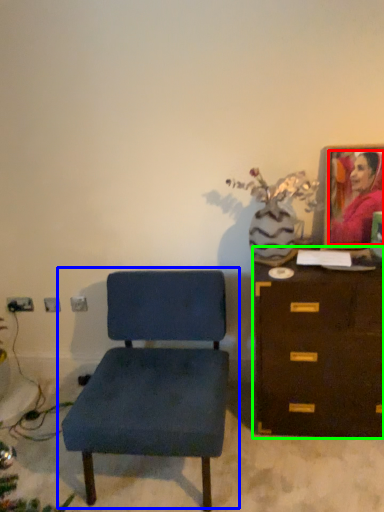
Question: Which is nearer to the person (highlighted by a red box)? chair (highlighted by a blue box) or chest of drawers (highlighted by a green box).

Choices:
 (A) chair
 (B) chest of drawers

Answer: (B)